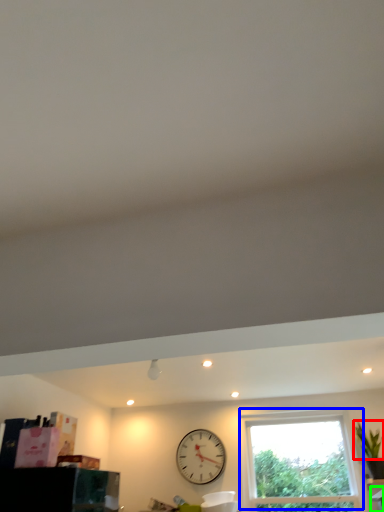
Question: Estimate the real-world distances between objects in this image. Which object is closer to plant (highlighted by a red box), window (highlighted by a blue box) or furniture (highlighted by a green box)?

Choices:
 (A) window
 (B) furniture

Answer: (B)